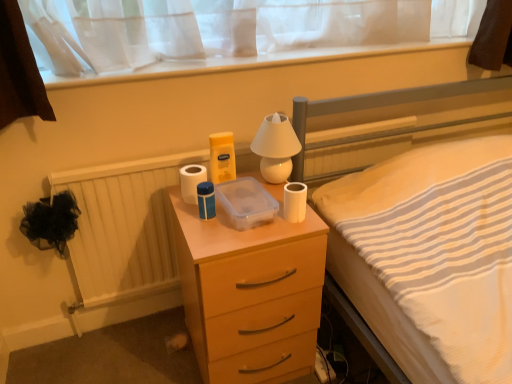
At what (x,y) coordinates should I click in order to perform the action: click on free space on the front side of white matte toilet paper at right, which appears as the 2th toilet paper when viewed from the left. Please return your answer as a coordinate pair (x, y). Image resolution: width=512 pixels, height=384 pixels. Looking at the image, I should click on (286, 233).